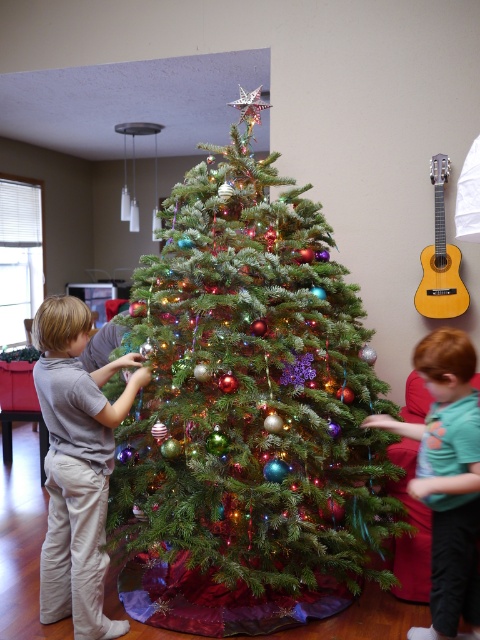
You are a drone operator who needs to capture a closeup shot of the green matte christmas tree at center. The drone has a maximum safe flying distance of 2 meters. Can the drone safely approach the tree for the shot?

The distance between the green matte christmas tree at center and the camera is 2.23 meters. Since the drone can only safely fly up to 2 meters, it cannot safely approach the tree for the closeup shot.

Looking at this image, looking at the two children in the scene, which child is wearing a smaller gray cotton shirt at left compared to the green cotton shirt at right?

The gray cotton shirt at left has a smaller size compared to the green cotton shirt at right.